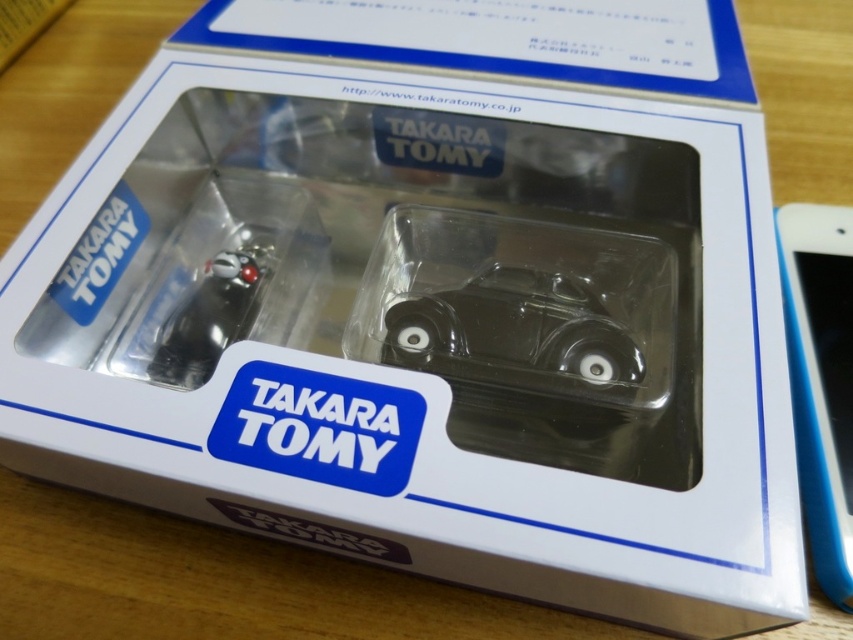
Where is the transparent plastic car at center located in the image?

The transparent plastic car at center is located at point coordinates of (515, 333).

You are examining the packaging of a toy set from Takara Tomy. You see a blue glossy smartphone at right and a shiny black car at center. Which object is located to the right of the other?

The blue glossy smartphone at right is positioned on the right side of the shiny black car at center.

You are designing a display stand for the Takara Tomy toy box and need to place the blue glossy smartphone at right and the shiny black car at center. Based on their sizes, which object should be placed lower on the stand to ensure stability?

The blue glossy smartphone at right is taller than the shiny black car at center, so to ensure stability, the taller smartphone should be placed lower on the stand to lower its center of gravity.